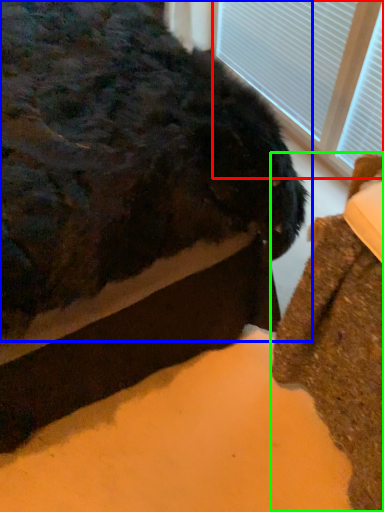
Question: Which is nearer to the bay window (highlighted by a red box)? animal (highlighted by a blue box) or furniture (highlighted by a green box).

Choices:
 (A) animal
 (B) furniture

Answer: (A)